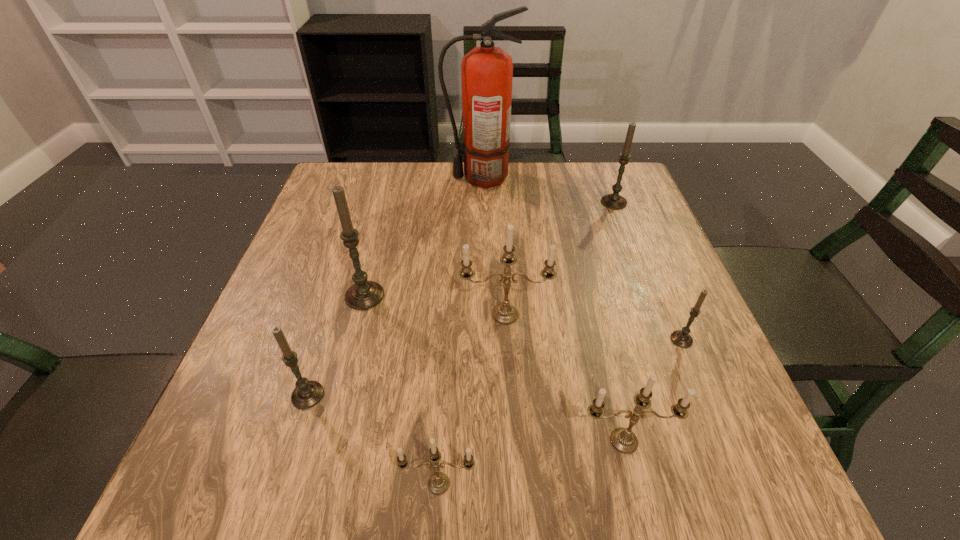
Where is `free space at the near edge`? Image resolution: width=960 pixels, height=540 pixels. free space at the near edge is located at coordinates (632, 471).

Find the location of a particular element. The width and height of the screenshot is (960, 540). vacant space at the left edge of the desktop is located at coordinates (300, 371).

In the image, there is a desktop. Where is `vacant space at the right edge`? Image resolution: width=960 pixels, height=540 pixels. vacant space at the right edge is located at coordinates (671, 382).

In the image, there is a desktop. Where is `free space at the far left corner`? This screenshot has height=540, width=960. free space at the far left corner is located at coordinates (353, 171).

I want to click on free region at the far right corner, so click(591, 192).

Locate an element on the screen. The height and width of the screenshot is (540, 960). free point between the nearest gray candle and the sixth object from left to right is located at coordinates (466, 418).

You are a GUI agent. You are given a task and a screenshot of the screen. Output one action in this format:
    pyautogui.click(x=<x>, y=<y>)
    Task: Click on the vacant area that lies between the nearest metallic candle and the tallest candle
    
    Given the screenshot: What is the action you would take?
    pyautogui.click(x=402, y=390)

Where is `vacant space that is in between the farthest object and the rightmost metallic candle`? The height and width of the screenshot is (540, 960). vacant space that is in between the farthest object and the rightmost metallic candle is located at coordinates (553, 309).

Identify the location of vacant area that lies between the fifth farthest object and the nearest metallic candle. (561, 411).

Identify the location of vacant area that lies between the nearest candle and the farthest object. (460, 330).